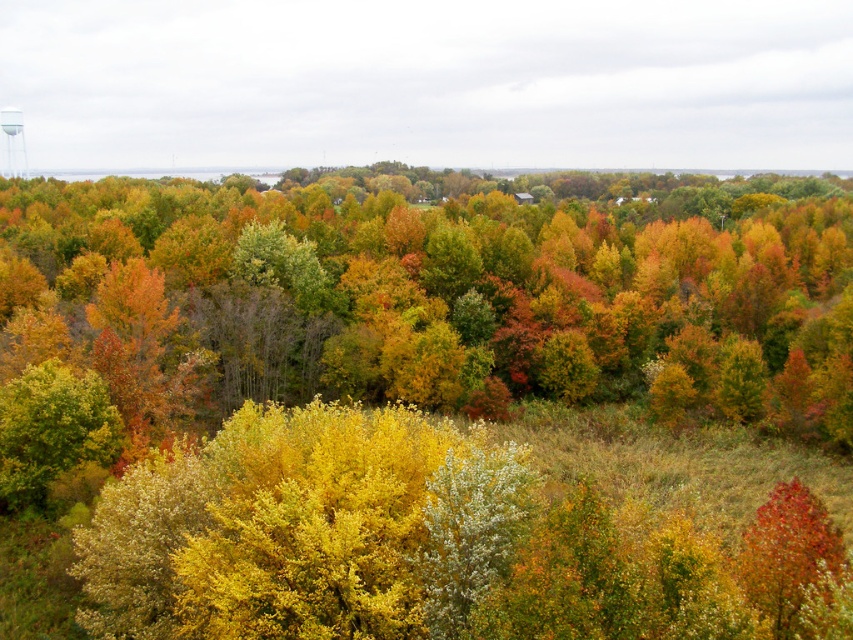
Question: Observing the image, what is the correct spatial positioning of yellow-green foliage at center in reference to white matte water tower at upper left?

Choices:
 (A) left
 (B) right

Answer: (B)

Question: Does yellow-green foliage at center appear on the right side of white matte water tower at upper left?

Choices:
 (A) no
 (B) yes

Answer: (B)

Question: Which object is closer to the camera taking this photo?

Choices:
 (A) white matte water tower at upper left
 (B) yellow-green foliage at center

Answer: (B)

Question: Does yellow-green foliage at center have a greater width compared to white matte water tower at upper left?

Choices:
 (A) no
 (B) yes

Answer: (B)